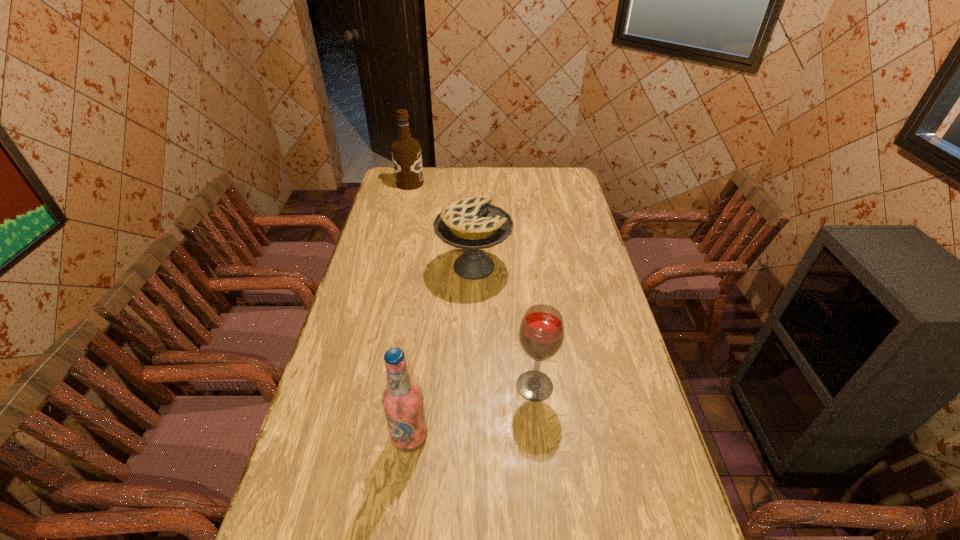
At what (x,y) coordinates should I click in order to perform the action: click on vacant space that is in between the second alcohol from left to right and the farthest object. Please return your answer as a coordinate pair (x, y). This screenshot has height=540, width=960. Looking at the image, I should click on (410, 310).

The width and height of the screenshot is (960, 540). Identify the location of empty space between the nearest alcohol and the shortest alcohol. (472, 411).

The width and height of the screenshot is (960, 540). I want to click on free space between the second farthest alcohol and the nearest alcohol, so click(x=472, y=411).

Where is `free spot between the third farthest object and the third nearest object`? This screenshot has height=540, width=960. free spot between the third farthest object and the third nearest object is located at coordinates (504, 326).

Image resolution: width=960 pixels, height=540 pixels. In order to click on vacant space in between the second alcohol from left to right and the farthest alcohol in this screenshot , I will do `click(410, 310)`.

Locate an element on the screen. The image size is (960, 540). free spot between the farthest alcohol and the shortest alcohol is located at coordinates (472, 285).

Find the location of a particular element. This screenshot has width=960, height=540. object that is the closest to the farthest object is located at coordinates (473, 223).

Identify which object is located as the second nearest to the nearest alcohol. Please provide its 2D coordinates. Your answer should be formatted as a tuple, i.e. [(x, y)], where the tuple contains the x and y coordinates of a point satisfying the conditions above.

[(473, 223)]

Identify the location of alcohol that is the second closest to the nearest object. This screenshot has width=960, height=540. (406, 153).

Image resolution: width=960 pixels, height=540 pixels. Find the location of `alcohol that is the nearest to the leftmost alcohol`. alcohol that is the nearest to the leftmost alcohol is located at coordinates (541, 333).